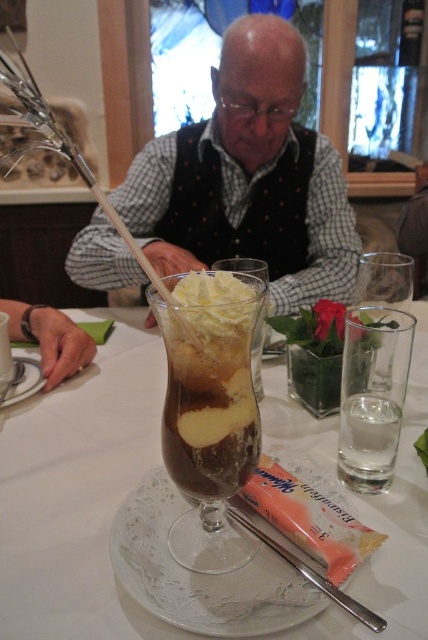
From the picture: Who is more forward, (318, 147) or (296, 534)?

Positioned in front is point (296, 534).

Which is more to the left, matte black vest at center or white creamy wafer at center?

matte black vest at center is more to the left.

At what (x,y) coordinates should I click in order to perform the action: click on matte black vest at center. Please return your answer as a coordinate pair (x, y). The width and height of the screenshot is (428, 640). Looking at the image, I should click on (249, 179).

What are the coordinates of `matte black vest at center` in the screenshot? It's located at (249, 179).

Can you confirm if matte black vest at center is smaller than white porcelain plate at lower left?

Incorrect, matte black vest at center is not smaller in size than white porcelain plate at lower left.

Who is higher up, matte black vest at center or white porcelain plate at lower left?

matte black vest at center is above.

Does point (89, 225) come behind point (38, 381)?

That is True.

Find the location of a particular element. This screenshot has width=428, height=640. matte black vest at center is located at coordinates (249, 179).

Does white creamy wafer at center have a larger size compared to clear glass water at right?

Correct, white creamy wafer at center is larger in size than clear glass water at right.

Between point (253, 500) and point (397, 419), which one is positioned in front?

Point (253, 500)

Where is `white creamy wafer at center`? white creamy wafer at center is located at coordinates (309, 516).